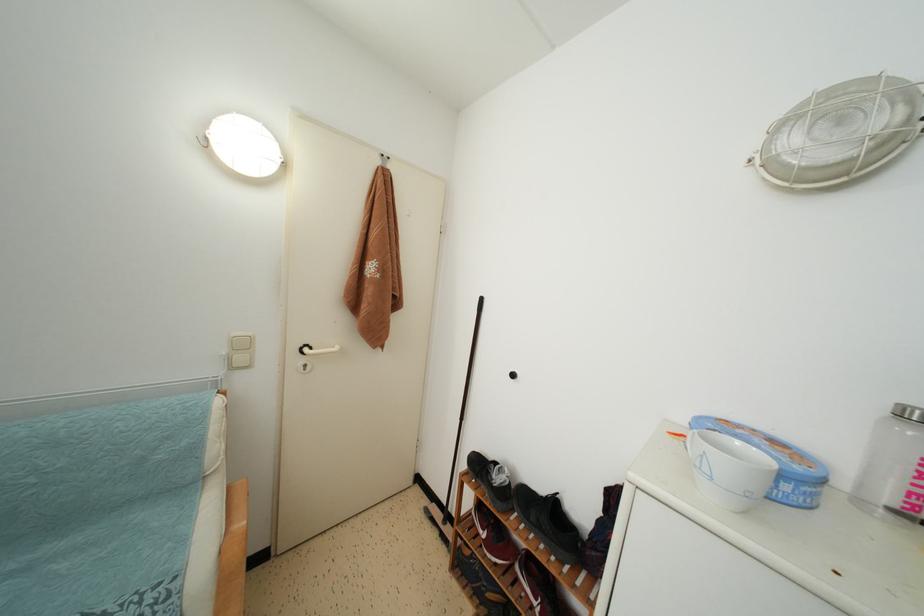
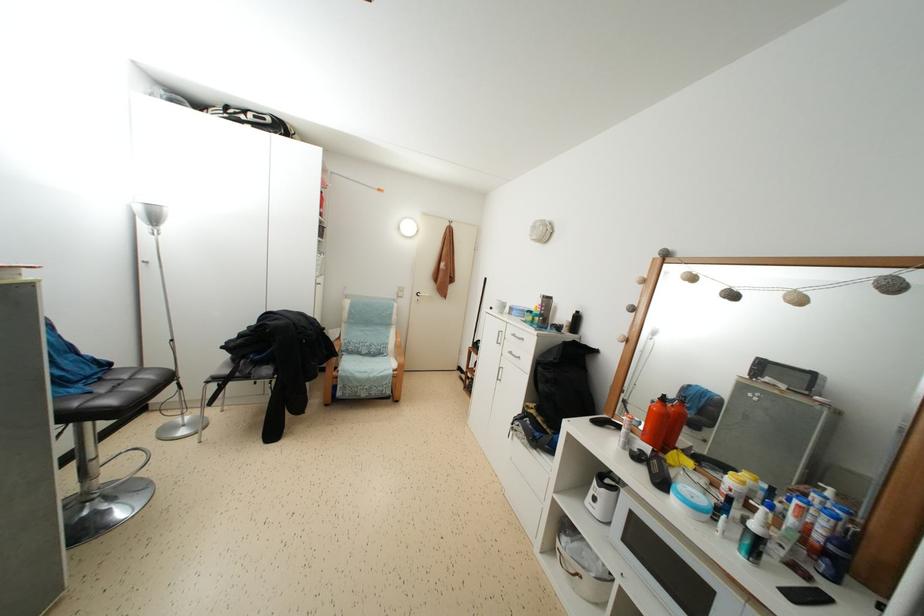
The point at (335, 331) is marked in the first image. Where is the corresponding point in the second image?

(432, 293)